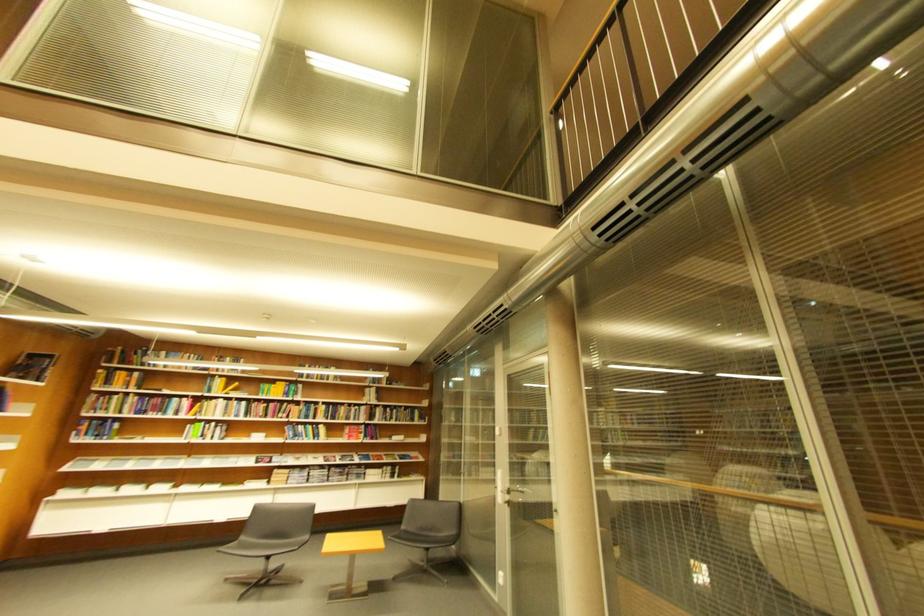
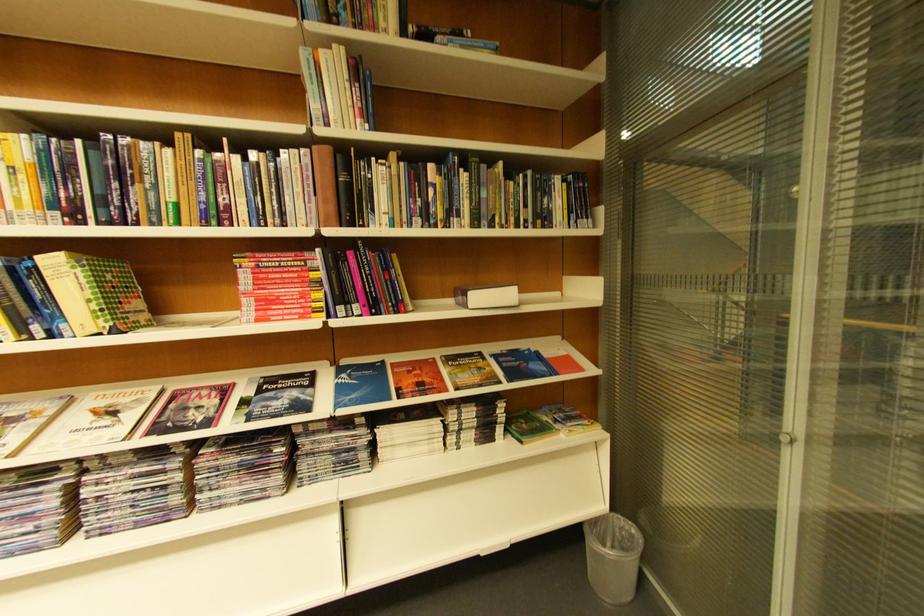
Locate, in the second image, the point that corresponds to pixel 362 429 in the first image.

(281, 262)